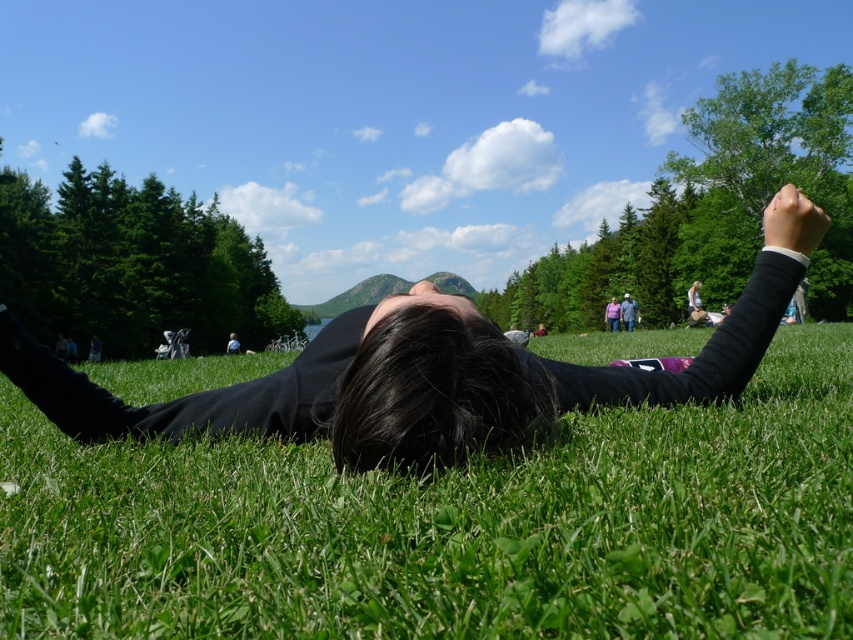
Question: Which point is closer to the camera?

Choices:
 (A) (701, 387)
 (B) (624, 305)
 (C) (569, 566)

Answer: (C)

Question: Which object is the farthest from the pink fabric at center?

Choices:
 (A) black matte person at center
 (B) gray fabric jacket at center

Answer: (A)

Question: Among these objects, which one is farthest from the camera?

Choices:
 (A) pink fabric at center
 (B) gray fabric jacket at center

Answer: (A)

Question: Does green grass at center come in front of gray fabric jacket at center?

Choices:
 (A) yes
 (B) no

Answer: (A)

Question: Is green grass at center wider than black matte person at center?

Choices:
 (A) no
 (B) yes

Answer: (B)

Question: From the image, what is the correct spatial relationship of green grass at center in relation to pink fabric at center?

Choices:
 (A) below
 (B) above

Answer: (A)